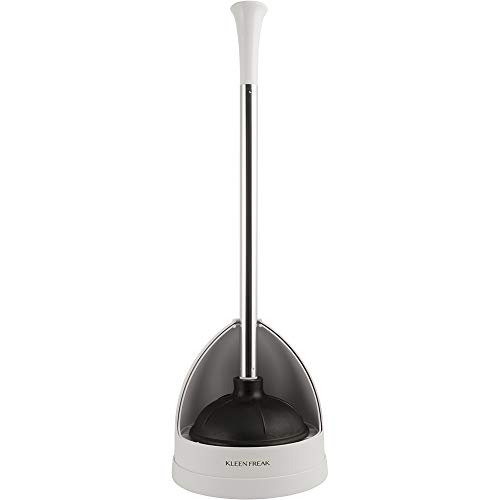
Locate an element on the screen. place to hold plunger is located at coordinates click(x=249, y=14).